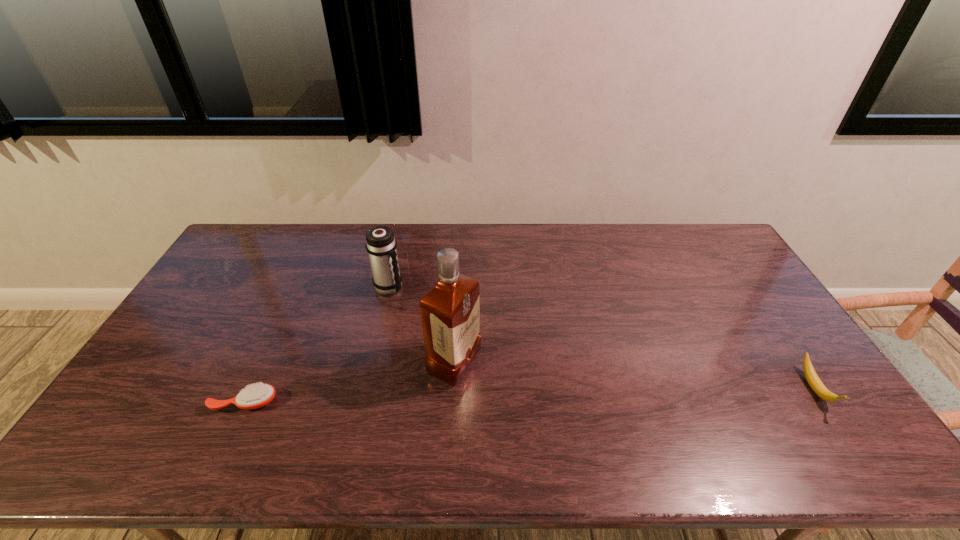
I want to click on vacant space located 0.220m on the front label of the tallest object, so click(x=553, y=410).

Where is `vacant space located 0.150m on the front label of the tallest object`? vacant space located 0.150m on the front label of the tallest object is located at coordinates (528, 399).

This screenshot has height=540, width=960. Find the location of `free space located on the side with the handle of the thermos bottle`. free space located on the side with the handle of the thermos bottle is located at coordinates [460, 322].

Where is `vacant area situated 0.070m on the side with the handle of the thermos bottle`? This screenshot has height=540, width=960. vacant area situated 0.070m on the side with the handle of the thermos bottle is located at coordinates (417, 301).

At what (x,y) coordinates should I click in order to perform the action: click on blank space located 0.330m on the side with the handle of the thermos bottle. Please return your answer as a coordinate pair (x, y). The width and height of the screenshot is (960, 540). Looking at the image, I should click on (484, 334).

This screenshot has width=960, height=540. Find the location of `hairbrush located in the near edge section of the desktop`. hairbrush located in the near edge section of the desktop is located at coordinates (255, 396).

The width and height of the screenshot is (960, 540). I want to click on banana that is at the near edge, so click(x=815, y=383).

At what (x,y) coordinates should I click in order to perform the action: click on object located at the right edge. Please return your answer as a coordinate pair (x, y). This screenshot has width=960, height=540. Looking at the image, I should click on (815, 383).

Where is `object located in the near right corner section of the desktop`? The height and width of the screenshot is (540, 960). object located in the near right corner section of the desktop is located at coordinates (815, 383).

In the image, there is a desktop. Where is `vacant space at the far edge`? The width and height of the screenshot is (960, 540). vacant space at the far edge is located at coordinates (668, 227).